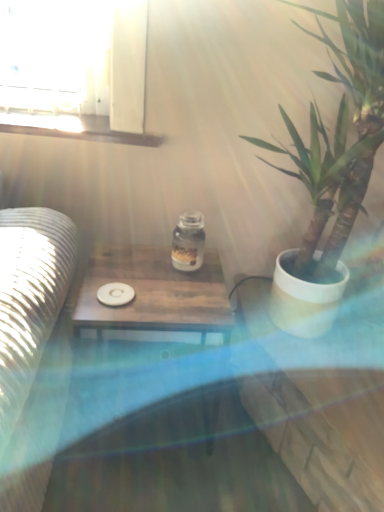
Question: Is green leafy plant in white pot at right facing away from wooden table at center?

Choices:
 (A) no
 (B) yes

Answer: (A)

Question: From a real-world perspective, is green leafy plant in white pot at right on wooden table at center?

Choices:
 (A) yes
 (B) no

Answer: (A)

Question: Considering the relative positions of green leafy plant in white pot at right and wooden table at center in the image provided, is green leafy plant in white pot at right to the right of wooden table at center from the viewer's perspective?

Choices:
 (A) yes
 (B) no

Answer: (A)

Question: Is green leafy plant in white pot at right thinner than wooden table at center?

Choices:
 (A) no
 (B) yes

Answer: (A)

Question: Is green leafy plant in white pot at right shorter than wooden table at center?

Choices:
 (A) no
 (B) yes

Answer: (A)

Question: Can you confirm if green leafy plant in white pot at right is wider than wooden table at center?

Choices:
 (A) yes
 (B) no

Answer: (A)

Question: From the image's perspective, does white matte coaster at center appear lower than transparent glass jar at center?

Choices:
 (A) yes
 (B) no

Answer: (A)

Question: Is transparent glass jar at center at the back of white matte coaster at center?

Choices:
 (A) yes
 (B) no

Answer: (B)

Question: From a real-world perspective, is white matte coaster at center on transparent glass jar at center?

Choices:
 (A) yes
 (B) no

Answer: (B)

Question: Is white matte coaster at center not inside transparent glass jar at center?

Choices:
 (A) yes
 (B) no

Answer: (A)

Question: Considering the relative positions of white matte coaster at center and transparent glass jar at center in the image provided, is white matte coaster at center to the left of transparent glass jar at center from the viewer's perspective?

Choices:
 (A) yes
 (B) no

Answer: (A)

Question: Is the depth of white matte coaster at center greater than that of transparent glass jar at center?

Choices:
 (A) yes
 (B) no

Answer: (B)

Question: Does white matte coaster at center have a lesser width compared to wooden table at center?

Choices:
 (A) yes
 (B) no

Answer: (A)